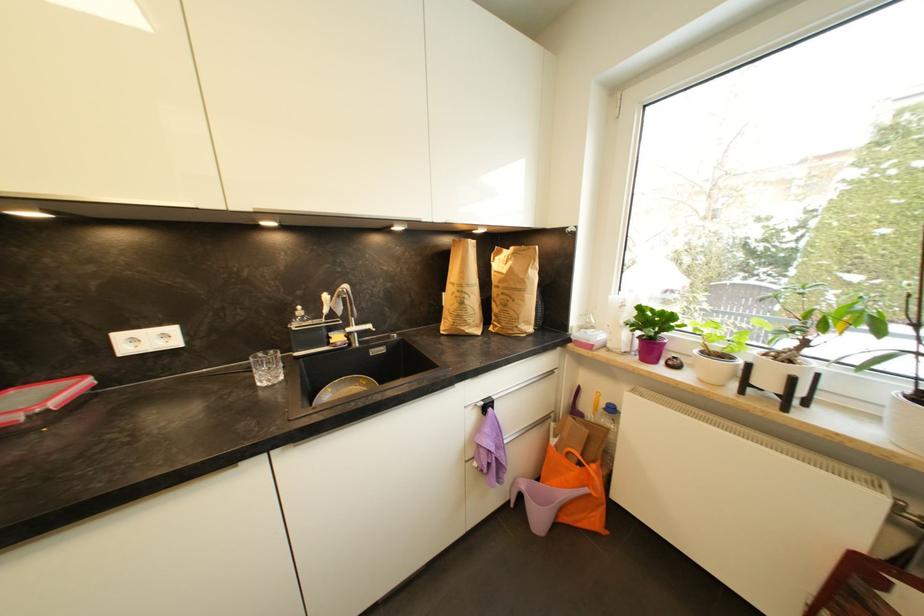
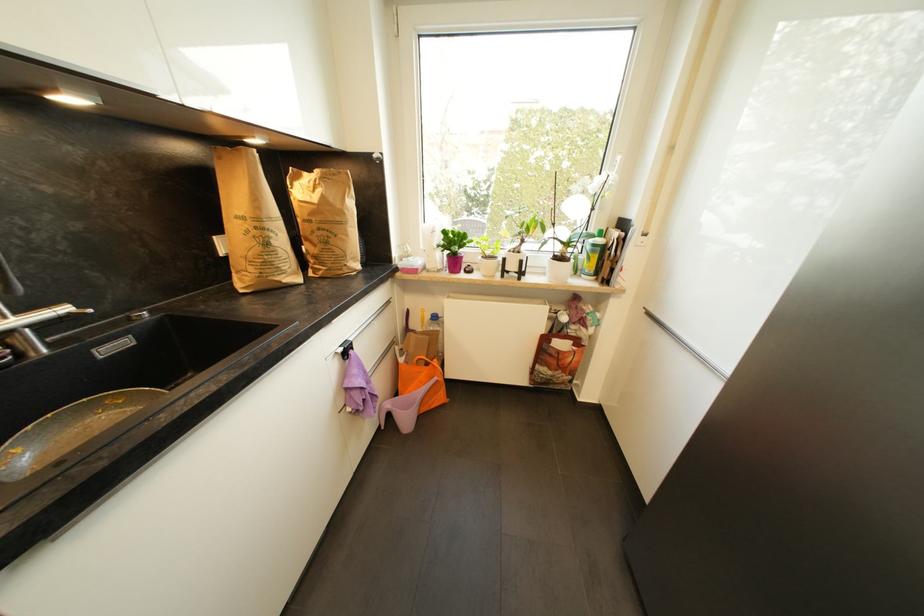
Find the pixel in the second image that matches the point at 487,405 in the first image.

(346, 351)